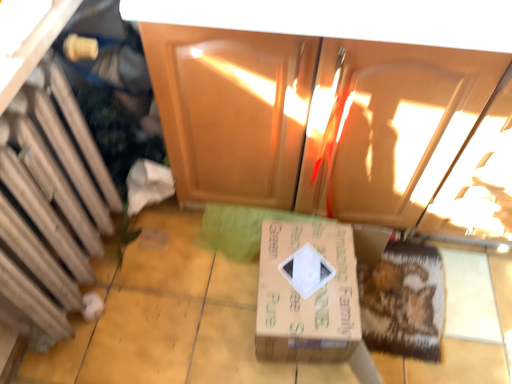
Question: Is brown cardboard box at center outside of matte wood cabinet at center, acting as the first cabinetry starting from the right?

Choices:
 (A) yes
 (B) no

Answer: (A)

Question: Is brown cardboard box at center at the left side of matte wood cabinet at center, the 2th cabinetry viewed from the left?

Choices:
 (A) yes
 (B) no

Answer: (A)

Question: From a real-world perspective, is brown cardboard box at center below matte wood cabinet at center, acting as the first cabinetry starting from the right?

Choices:
 (A) yes
 (B) no

Answer: (A)

Question: Is brown cardboard box at center to the right of matte wood cabinet at center, the 2th cabinetry viewed from the left, from the viewer's perspective?

Choices:
 (A) yes
 (B) no

Answer: (B)

Question: Is brown cardboard box at center surrounding matte wood cabinet at center, the 2th cabinetry viewed from the left?

Choices:
 (A) yes
 (B) no

Answer: (B)

Question: Is the position of brown cardboard box at center more distant than that of matte wood cabinet at center, acting as the first cabinetry starting from the right?

Choices:
 (A) no
 (B) yes

Answer: (B)

Question: From a real-world perspective, is matte wood cabinet at center, the 2th cabinetry viewed from the left, beneath brown cardboard box at center?

Choices:
 (A) no
 (B) yes

Answer: (A)

Question: From a real-world perspective, is matte wood cabinet at center, acting as the first cabinetry starting from the right, physically above brown cardboard box at center?

Choices:
 (A) yes
 (B) no

Answer: (A)

Question: Is matte wood cabinet at center, the 2th cabinetry viewed from the left, smaller than brown cardboard box at center?

Choices:
 (A) yes
 (B) no

Answer: (B)

Question: Are matte wood cabinet at center, acting as the first cabinetry starting from the right, and brown cardboard box at center located far from each other?

Choices:
 (A) no
 (B) yes

Answer: (A)

Question: Is matte wood cabinet at center, acting as the first cabinetry starting from the right, with brown cardboard box at center?

Choices:
 (A) no
 (B) yes

Answer: (A)

Question: Is the depth of matte wood cabinet at center, the 2th cabinetry viewed from the left, greater than that of brown cardboard box at center?

Choices:
 (A) yes
 (B) no

Answer: (B)

Question: From the image's perspective, does brown cardboard box at center appear higher than wooden cabinet at left, which appears as the 1th cabinetry when viewed from the left?

Choices:
 (A) no
 (B) yes

Answer: (A)